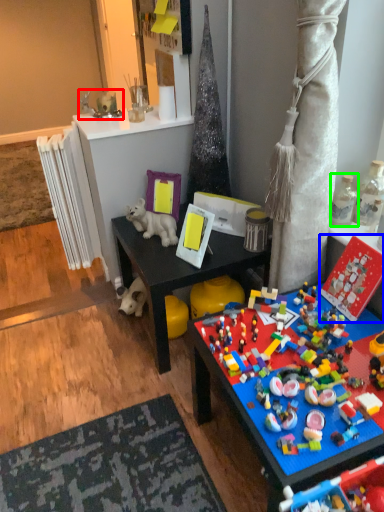
Question: Which object is positioned closest to toy (highlighted by a red box)? Select from toy (highlighted by a blue box) and toy (highlighted by a green box).

Choices:
 (A) toy
 (B) toy

Answer: (B)